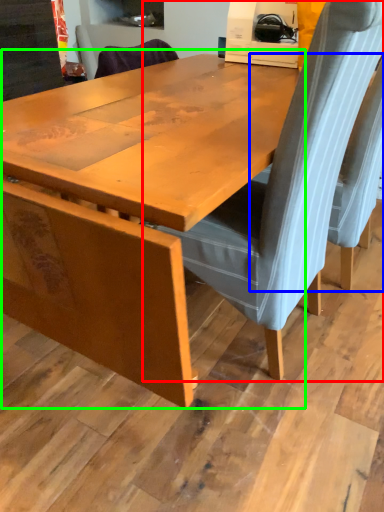
Question: Considering the real-world distances, which object is farthest from chair (highlighted by a red box)? chair (highlighted by a blue box) or table (highlighted by a green box)?

Choices:
 (A) chair
 (B) table

Answer: (A)